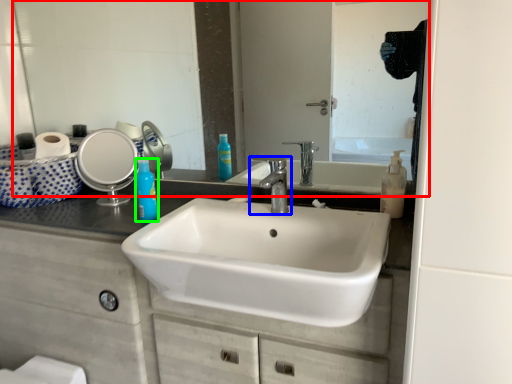
Question: Considering the real-world distances, which object is closest to mirror (highlighted by a red box)? tap (highlighted by a blue box) or mouthwash (highlighted by a green box).

Choices:
 (A) tap
 (B) mouthwash

Answer: (A)